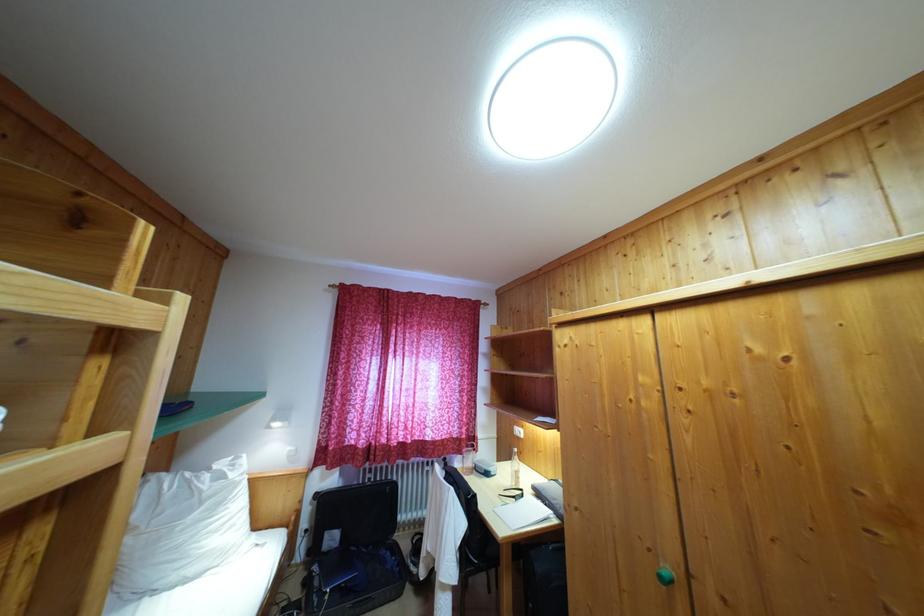
What do you see at coordinates (57, 468) in the screenshot? The height and width of the screenshot is (616, 924). I see `a wooden ladder rung` at bounding box center [57, 468].